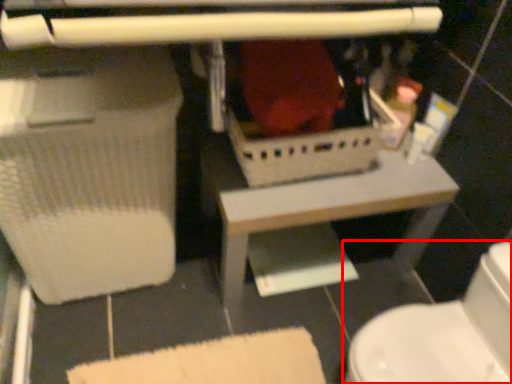
Question: From the image's perspective, where is toilet (annotated by the red box) located relative to table?

Choices:
 (A) below
 (B) above

Answer: (A)